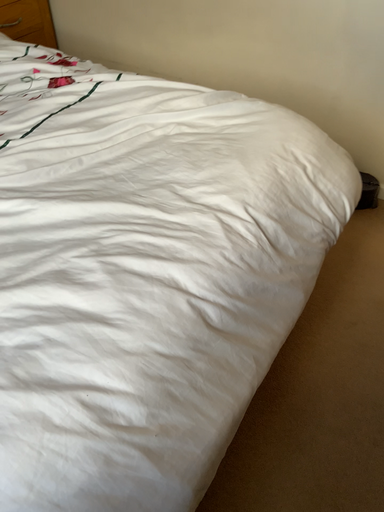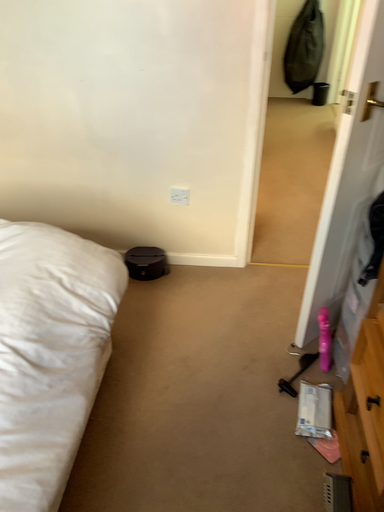
Question: Which way did the camera rotate in the video?

Choices:
 (A) rotated upward
 (B) rotated downward

Answer: (A)